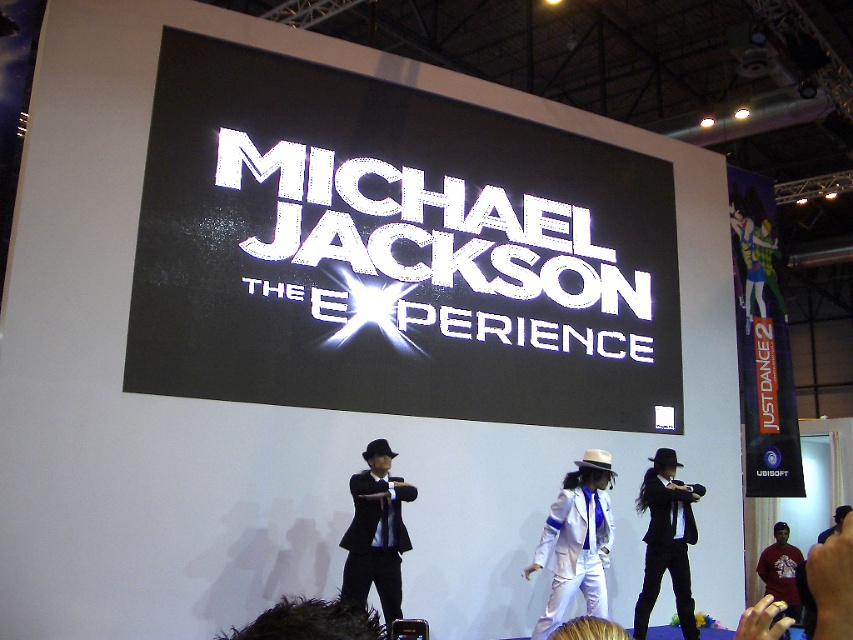
Looking at this image, you are a photographer at the event and want to capture both the black matte suit at center and the red cotton shirt at lower right in the same frame. Which one should you focus on first to ensure both are in focus?

The black matte suit at center has a smaller size compared to the red cotton shirt at lower right. To ensure both are in focus, you should focus on the smaller object first, which is the black matte suit at center.

You are a photographer at the event and need to capture a photo where both the black matte suit at center and the red cotton shirt at lower right are visible. Considering their heights, which performer should you focus on first to ensure both are in frame?

The black matte suit at center is taller than the red cotton shirt at lower right. To ensure both are in frame, focus on the black matte suit at center first as it occupies more vertical space, then adjust to include the shorter performer.

You are a photographer at the event and want to capture a clear shot of both the white satin hat at center and the red cotton shirt at lower right. Considering their heights, which object will appear larger in the photo?

The white satin hat at center will appear larger in the photo because it is much taller than the red cotton shirt at lower right.